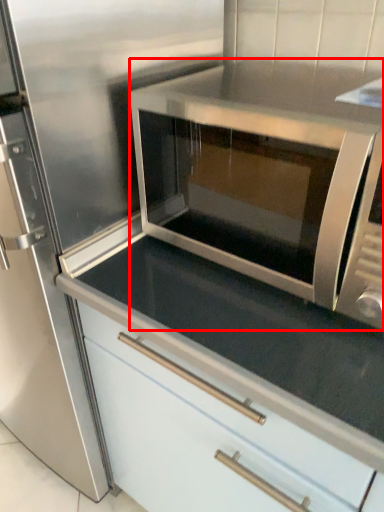
Question: In this image, where is microwave oven (annotated by the red box) located relative to cabinetry?

Choices:
 (A) right
 (B) left

Answer: (A)